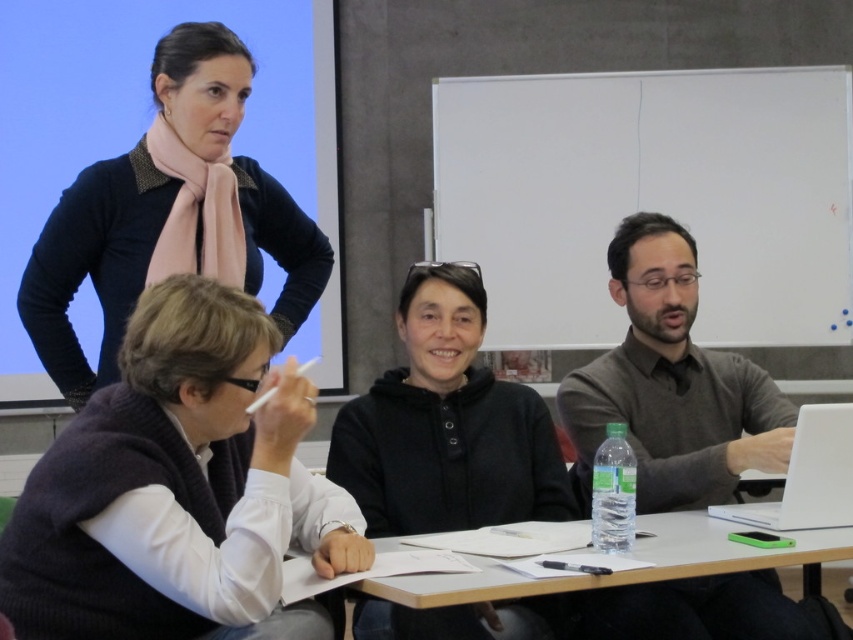
Question: Which point appears farthest from the camera in this image?

Choices:
 (A) (514, 509)
 (B) (97, 438)
 (C) (666, 337)
 (D) (64, 365)

Answer: (C)

Question: Considering the real-world distances, which object is closest to the white plastic table at lower center?

Choices:
 (A) dark purple sweater at lower left
 (B) matte gray sweater at center

Answer: (B)

Question: Does matte gray sweater at center appear under matte black sweater at upper left?

Choices:
 (A) no
 (B) yes

Answer: (B)

Question: Can you confirm if matte gray sweater at center is positioned to the left of white plastic table at lower center?

Choices:
 (A) yes
 (B) no

Answer: (B)

Question: Can you confirm if matte gray sweater at center is positioned to the left of black matte hoodie at center?

Choices:
 (A) no
 (B) yes

Answer: (A)

Question: Which of these objects is positioned farthest from the black matte hoodie at center?

Choices:
 (A) matte gray sweater at center
 (B) dark purple sweater at lower left

Answer: (B)